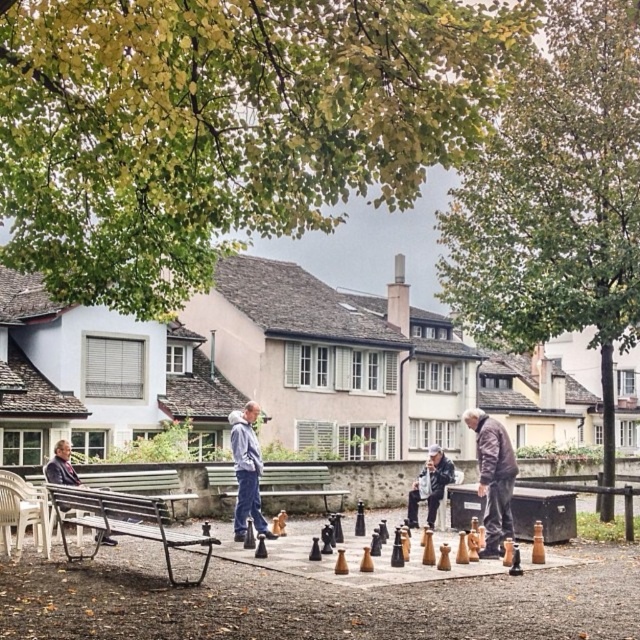
Question: Does metallic polished bench at lower left come in front of dark gray fabric jacket at lower center?

Choices:
 (A) yes
 (B) no

Answer: (A)

Question: Can you confirm if light blue denim pants at center is bigger than dark gray fabric jacket at lower center?

Choices:
 (A) no
 (B) yes

Answer: (B)

Question: Which point is closer to the camera taking this photo?

Choices:
 (A) (109, 480)
 (B) (442, 483)
 (C) (236, 516)
 (D) (490, 440)

Answer: (D)

Question: Is metallic polished bench at lower left below wooden bench at left?

Choices:
 (A) no
 (B) yes

Answer: (A)

Question: Which point is farther from the camera taking this photo?

Choices:
 (A) pos(64,451)
 (B) pos(177,532)
 (C) pos(212,474)

Answer: (C)

Question: Which point is closer to the camera?

Choices:
 (A) (19, 525)
 (B) (58, 476)
 (C) (484, 461)

Answer: (A)